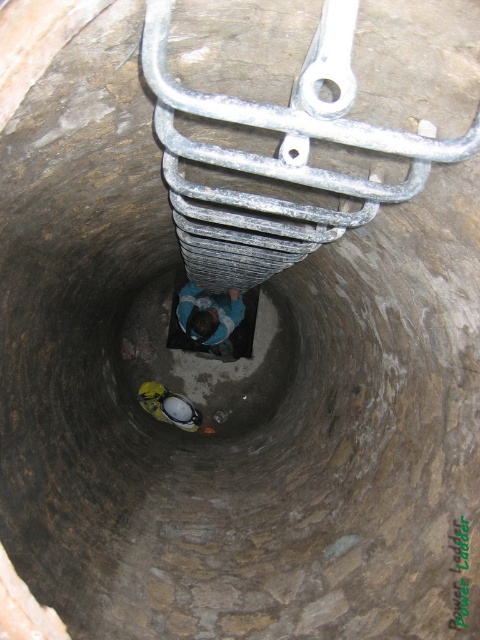
Can you confirm if galvanized metal ladder at center is shorter than yellow fabric helmet at center?

Correct, galvanized metal ladder at center is not as tall as yellow fabric helmet at center.

Which is behind, point (171, 6) or point (166, 387)?

The point (166, 387) is behind.

Where is `galvanized metal ladder at center`? galvanized metal ladder at center is located at coordinates (276, 157).

Is galvanized metal ladder at center positioned in front of smooth concrete hole at center?

Yes, it is.

Who is shorter, galvanized metal ladder at center or smooth concrete hole at center?

With less height is galvanized metal ladder at center.

This screenshot has height=640, width=480. I want to click on galvanized metal ladder at center, so click(276, 157).

Can you confirm if smooth concrete hole at center is positioned above blue fabric shirt at center?

Incorrect, smooth concrete hole at center is not positioned above blue fabric shirt at center.

Does smooth concrete hole at center appear on the left side of blue fabric shirt at center?

Yes, smooth concrete hole at center is to the left of blue fabric shirt at center.

Measure the distance between smooth concrete hole at center and camera.

3.77 meters

At what (x,y) coordinates should I click in order to perform the action: click on smooth concrete hole at center. Please return your answer as a coordinate pair (x, y). Image resolution: width=480 pixels, height=640 pixels. Looking at the image, I should click on (201, 358).